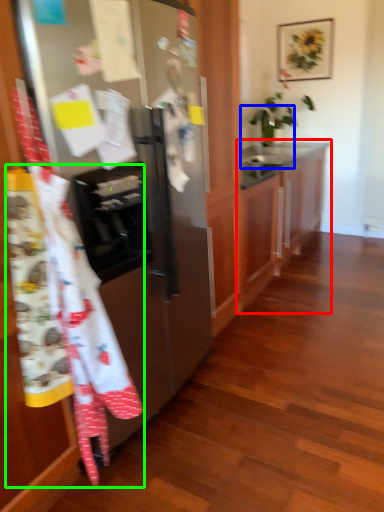
Question: Considering the real-world distances, which object is farthest from cabinetry (highlighted by a red box)? sink (highlighted by a blue box) or blanket (highlighted by a green box)?

Choices:
 (A) sink
 (B) blanket

Answer: (B)